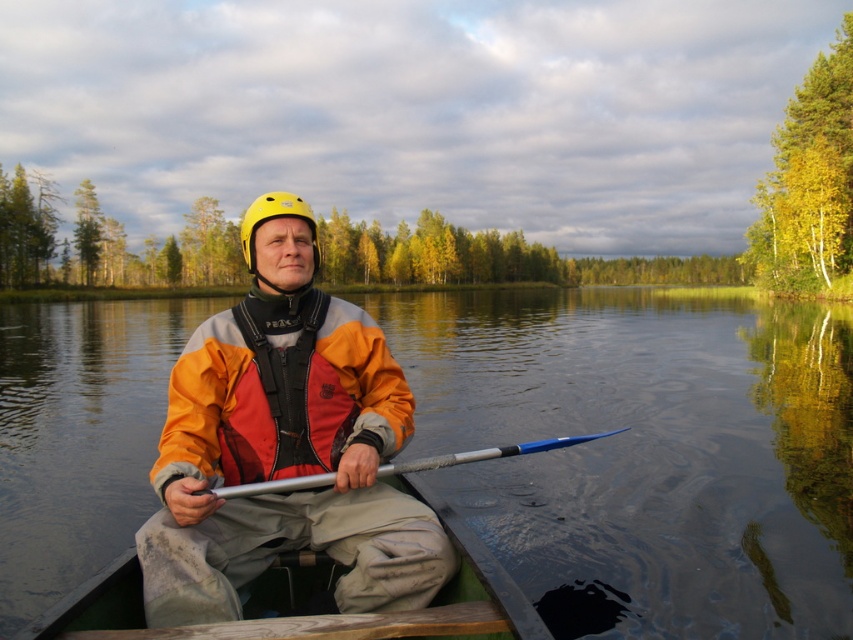
In the scene shown: You are a photographer trying to capture the kayaker from the shore. You notice the orange fabric life jacket at center and the yellow matte helmet at center. Which object should you focus on first if you want to capture the one that is positioned more to the left?

The yellow matte helmet at center is positioned more to the left compared to the orange fabric life jacket at center, so you should focus on the yellow matte helmet at center first.

You are a photographer trying to capture the orange fabric life jacket at center and the silver metallic paddle at center in the same frame. Based on their positions, which object is closer to the camera?

The orange fabric life jacket at center is positioned over the silver metallic paddle at center, so it is closer to the camera.